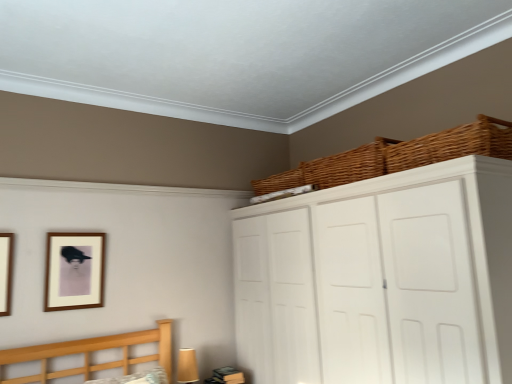
Question: Can you confirm if white matte cupboard at upper right is positioned to the left of matte brown picture frame at upper left, arranged as the 1th picture frame when viewed from the back?

Choices:
 (A) yes
 (B) no

Answer: (B)

Question: Is white matte cupboard at upper right further to the viewer compared to matte brown picture frame at upper left, arranged as the second picture frame when viewed from the front?

Choices:
 (A) no
 (B) yes

Answer: (A)

Question: Considering the relative sizes of white matte cupboard at upper right and matte brown picture frame at upper left, which is the 1th picture frame in right-to-left order, in the image provided, is white matte cupboard at upper right wider than matte brown picture frame at upper left, which is the 1th picture frame in right-to-left order,?

Choices:
 (A) no
 (B) yes

Answer: (B)

Question: Does white matte cupboard at upper right have a lesser width compared to matte brown picture frame at upper left, which appears as the second picture frame when viewed from the left?

Choices:
 (A) yes
 (B) no

Answer: (B)

Question: From a real-world perspective, is white matte cupboard at upper right on matte brown picture frame at upper left, arranged as the 1th picture frame when viewed from the back?

Choices:
 (A) no
 (B) yes

Answer: (A)

Question: Is matte brown picture frame at upper left, arranged as the second picture frame when viewed from the front, a part of white matte cupboard at upper right?

Choices:
 (A) no
 (B) yes

Answer: (A)

Question: Would you say woven brown basket at upper center, which is counted as the 3th basket, starting from the front, contains white matte cupboard at upper right?

Choices:
 (A) no
 (B) yes

Answer: (A)

Question: Can you confirm if woven brown basket at upper center, which is counted as the 3th basket, starting from the front, is positioned to the right of white matte cupboard at upper right?

Choices:
 (A) no
 (B) yes

Answer: (A)

Question: Is woven brown basket at upper center, which is the 1th basket in back-to-front order, at the left side of white matte cupboard at upper right?

Choices:
 (A) no
 (B) yes

Answer: (B)

Question: Does woven brown basket at upper center, which is counted as the 3th basket, starting from the front, turn towards white matte cupboard at upper right?

Choices:
 (A) yes
 (B) no

Answer: (B)

Question: Can you confirm if woven brown basket at upper center, which is the 1th basket in back-to-front order, is thinner than white matte cupboard at upper right?

Choices:
 (A) no
 (B) yes

Answer: (B)

Question: From a real-world perspective, does woven brown basket at upper center, which is counted as the 3th basket, starting from the front, stand above white matte cupboard at upper right?

Choices:
 (A) no
 (B) yes

Answer: (B)

Question: Does matte brown picture frame at upper left, arranged as the second picture frame when viewed from the front, have a greater width compared to white matte cupboard at upper right?

Choices:
 (A) no
 (B) yes

Answer: (A)